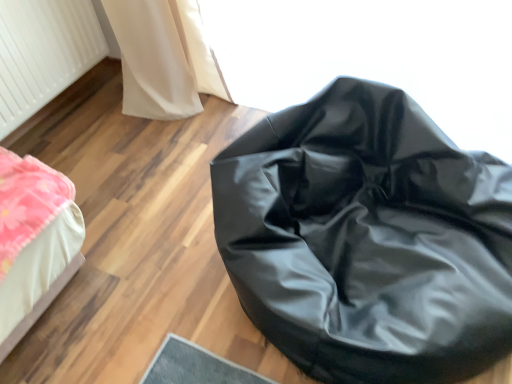
Identify the location of vacant space underneath white textured radiator at upper left (from a real-world perspective). (63, 108).